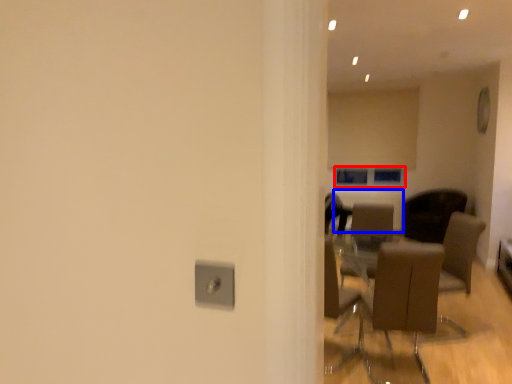
Question: Which point is further to the camera, window (highlighted by a red box) or radiator (highlighted by a blue box)?

Choices:
 (A) window
 (B) radiator

Answer: (A)